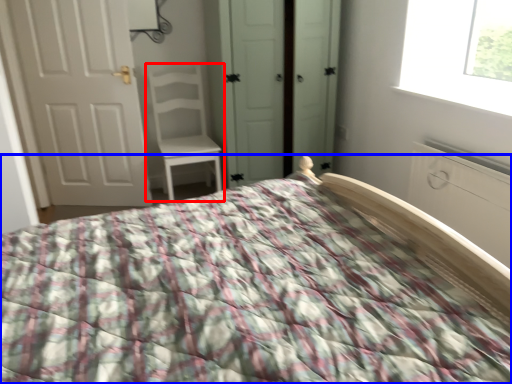
Question: Which of the following is the farthest to the observer, chair (highlighted by a red box) or bed (highlighted by a blue box)?

Choices:
 (A) chair
 (B) bed

Answer: (A)